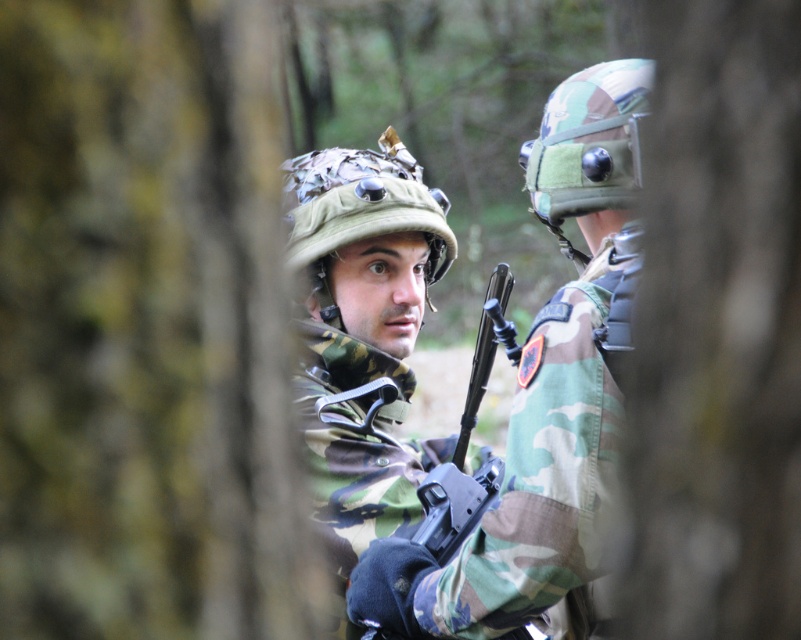
Question: Estimate the real-world distances between objects in this image. Which object is farther from the camouflage fabric uniform at center?

Choices:
 (A) camo fabric helmet at center
 (B) matte black rifle at center

Answer: (A)

Question: Can you confirm if brown rough bark at center is thinner than matte black rifle at center?

Choices:
 (A) yes
 (B) no

Answer: (A)

Question: Can you confirm if camouflage fabric uniform at center is positioned above matte black rifle at center?

Choices:
 (A) yes
 (B) no

Answer: (B)

Question: Which point is closer to the camera?

Choices:
 (A) camouflage fabric uniform at center
 (B) brown rough bark at center

Answer: (B)

Question: Is camo fabric helmet at center bigger than matte black rifle at center?

Choices:
 (A) yes
 (B) no

Answer: (A)

Question: Which point is farther to the camera?

Choices:
 (A) (479, 378)
 (B) (682, 554)

Answer: (A)